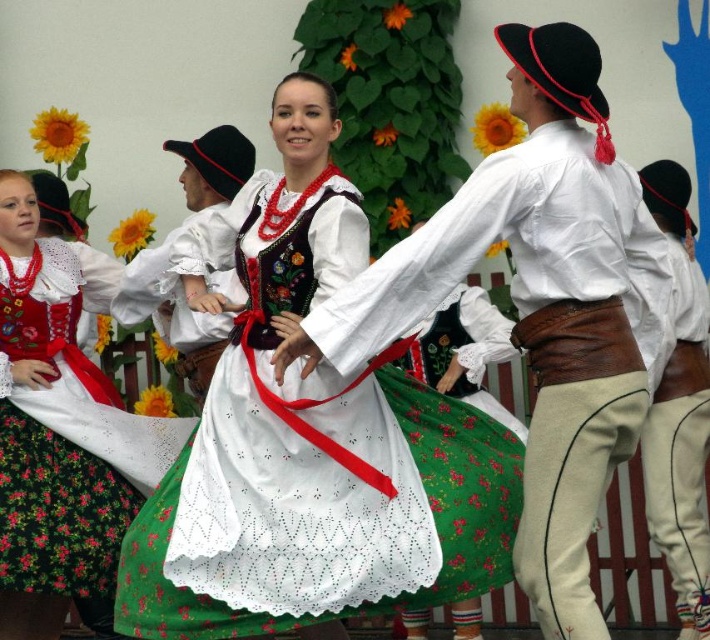
Question: Is white satin dress at center in front of green floral skirt at center?

Choices:
 (A) no
 (B) yes

Answer: (B)

Question: Is white lace dress at center below green floral skirt at center?

Choices:
 (A) yes
 (B) no

Answer: (B)

Question: Observing the image, what is the correct spatial positioning of white satin dress at center in reference to white lace dress at center?

Choices:
 (A) left
 (B) right

Answer: (A)

Question: Considering the real-world distances, which object is farthest from the white satin dress at center?

Choices:
 (A) green floral skirt at center
 (B) white lace dress at center

Answer: (A)

Question: Which object appears closest to the camera in this image?

Choices:
 (A) white satin dress at center
 (B) white lace dress at center

Answer: (B)

Question: Which is farther from the green floral skirt at center?

Choices:
 (A) white lace dress at center
 (B) white satin dress at center

Answer: (A)